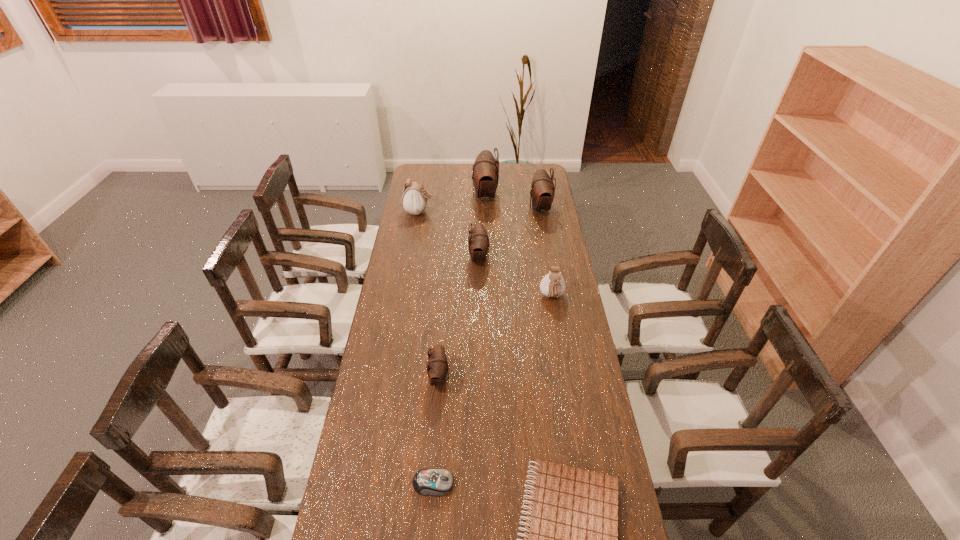
Where is `the third nearest object`? The height and width of the screenshot is (540, 960). the third nearest object is located at coordinates (437, 364).

Find the location of a particular element. The height and width of the screenshot is (540, 960). computer mouse is located at coordinates (438, 481).

Locate an element on the screen. This screenshot has height=540, width=960. free region located with the flap open on the tallest object is located at coordinates (418, 195).

The image size is (960, 540). What are the coordinates of `vacant space located with the flap open on the tallest object` in the screenshot? It's located at (412, 195).

Image resolution: width=960 pixels, height=540 pixels. I want to click on free space located 0.120m with the flap open on the tallest object, so click(449, 195).

Identify the location of vacant area located with the flap open on the rightmost brown pouch. This screenshot has height=540, width=960. (519, 208).

Find the location of a particular element. This screenshot has height=540, width=960. vacant space located with the flap open on the rightmost brown pouch is located at coordinates (467, 208).

You are a GUI agent. You are given a task and a screenshot of the screen. Output one action in this format:
    pyautogui.click(x=<x>, y=<y>)
    Task: Click on the free space located 0.090m with the flap open on the rightmost brown pouch
    
    Given the screenshot: What is the action you would take?
    pyautogui.click(x=511, y=208)

At what (x,y) coordinates should I click in order to perform the action: click on vacant area located 0.180m on the front-facing side of the leftmost pouch. Please return your answer as a coordinate pair (x, y). Looking at the image, I should click on (471, 212).

This screenshot has height=540, width=960. I want to click on free space located with the flap open on the third farthest brown pouch, so click(523, 258).